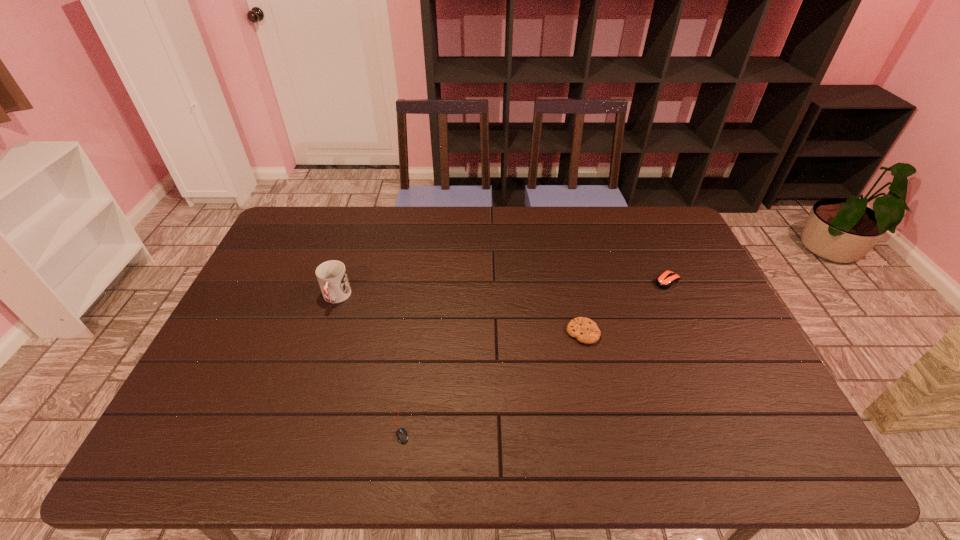
What are the coordinates of `free space between the cup and the nearer mouse` in the screenshot? It's located at (369, 362).

At what (x,y) coordinates should I click in order to perform the action: click on free space between the shorter mouse and the taller mouse. Please return your answer as a coordinate pair (x, y). The image size is (960, 540). Looking at the image, I should click on (535, 354).

You are a GUI agent. You are given a task and a screenshot of the screen. Output one action in this format:
    pyautogui.click(x=<x>, y=<y>)
    Task: Click on the vacant area that lies between the cup and the second nearest object
    
    Given the screenshot: What is the action you would take?
    pyautogui.click(x=460, y=315)

This screenshot has width=960, height=540. What are the coordinates of `empty space that is in between the second object from left to right and the farther mouse` in the screenshot? It's located at (535, 354).

Locate an element on the screen. The width and height of the screenshot is (960, 540). blank region between the farther mouse and the leftmost object is located at coordinates pos(502,289).

Where is `unoccupied area between the cup and the rightmost object`? unoccupied area between the cup and the rightmost object is located at coordinates (502, 289).

The height and width of the screenshot is (540, 960). Identify the location of vacant point located between the second object from right to left and the shortest object. (492, 380).

Where is `free space that is in between the cookie and the leftmost object`? Image resolution: width=960 pixels, height=540 pixels. free space that is in between the cookie and the leftmost object is located at coordinates (460, 315).

Find the location of a particular element. This screenshot has width=960, height=540. vacant space in between the rightmost object and the leftmost object is located at coordinates (502, 289).

You are a GUI agent. You are given a task and a screenshot of the screen. Output one action in this format:
    pyautogui.click(x=<x>, y=<y>)
    Task: Click on the vacant point located between the third object from right to left and the leftmost object
    
    Given the screenshot: What is the action you would take?
    click(x=369, y=362)